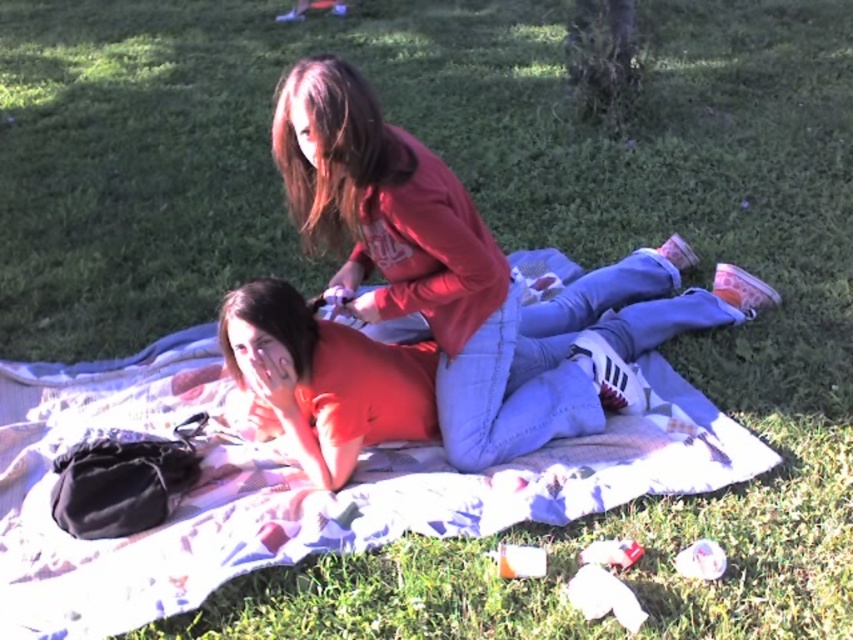
Between orange matte shirt at center and matte red shirt at center, which one is positioned higher?

matte red shirt at center

Does point (660, 268) come farther from viewer compared to point (469, 330)?

Yes, it is behind point (469, 330).

Where is `orange matte shirt at center`? This screenshot has height=640, width=853. orange matte shirt at center is located at coordinates (469, 364).

Identify the location of orange matte shirt at center. (469, 364).

What do you see at coordinates (294, 486) in the screenshot? I see `white cotton blanket at center` at bounding box center [294, 486].

Which is more to the left, white cotton blanket at center or matte red shirt at center?

From the viewer's perspective, white cotton blanket at center appears more on the left side.

The height and width of the screenshot is (640, 853). Find the location of `white cotton blanket at center`. white cotton blanket at center is located at coordinates (294, 486).

This screenshot has width=853, height=640. I want to click on white cotton blanket at center, so click(x=294, y=486).

Can you confirm if white cotton blanket at center is positioned to the left of orange matte shirt at center?

Indeed, white cotton blanket at center is positioned on the left side of orange matte shirt at center.

Does point (628, 433) come closer to viewer compared to point (323, 429)?

No, it is behind (323, 429).

Describe the element at coordinates (294, 486) in the screenshot. I see `white cotton blanket at center` at that location.

You are a GUI agent. You are given a task and a screenshot of the screen. Output one action in this format:
    pyautogui.click(x=<x>, y=<y>)
    Task: Click on the white cotton blanket at center
    This screenshot has width=853, height=640.
    Given the screenshot: What is the action you would take?
    pyautogui.click(x=294, y=486)